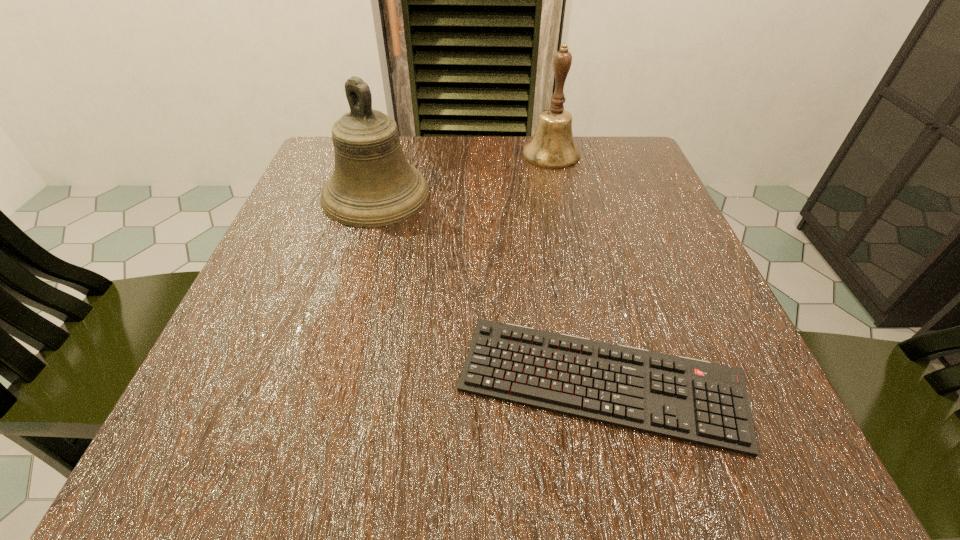
Where is `object that is the second nearest to the right bell`? This screenshot has height=540, width=960. object that is the second nearest to the right bell is located at coordinates (691, 400).

At what (x,y) coordinates should I click in order to perform the action: click on free space that satisfies the following two spatial constraints: 1. on the front side of the computer keyboard; 2. on the left side of the leftmost object. Please return your answer as a coordinate pair (x, y). This screenshot has height=540, width=960. Looking at the image, I should click on (322, 382).

Locate an element on the screen. free spot that satisfies the following two spatial constraints: 1. on the back side of the right bell; 2. on the left side of the shortest object is located at coordinates (550, 154).

The image size is (960, 540). Find the location of `free spot that satisfies the following two spatial constraints: 1. on the back side of the right bell; 2. on the left side of the computer keyboard`. free spot that satisfies the following two spatial constraints: 1. on the back side of the right bell; 2. on the left side of the computer keyboard is located at coordinates (550, 154).

The height and width of the screenshot is (540, 960). I want to click on vacant space that satisfies the following two spatial constraints: 1. on the back side of the right bell; 2. on the right side of the left bell, so pyautogui.click(x=388, y=154).